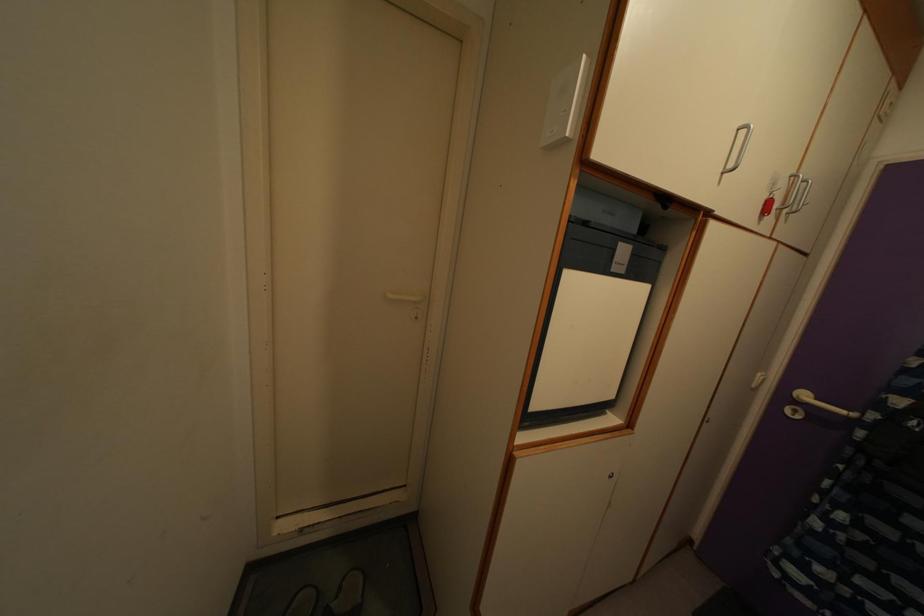
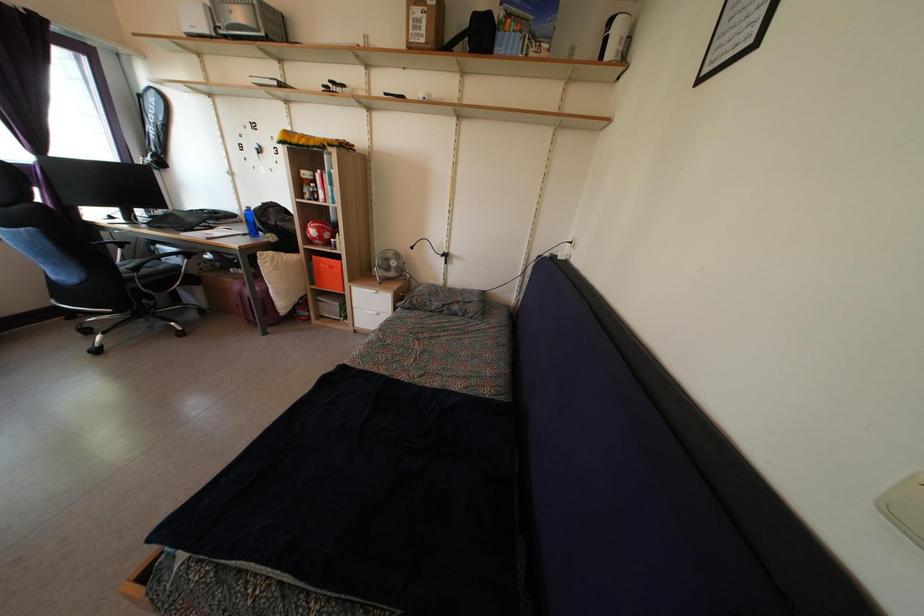
Question: The camera is either moving clockwise (left) or counter-clockwise (right) around the object. The first image is from the beginning of the video and the second image is from the end. Is the camera moving left or right when shooting the video?

Choices:
 (A) Left
 (B) Right

Answer: (B)